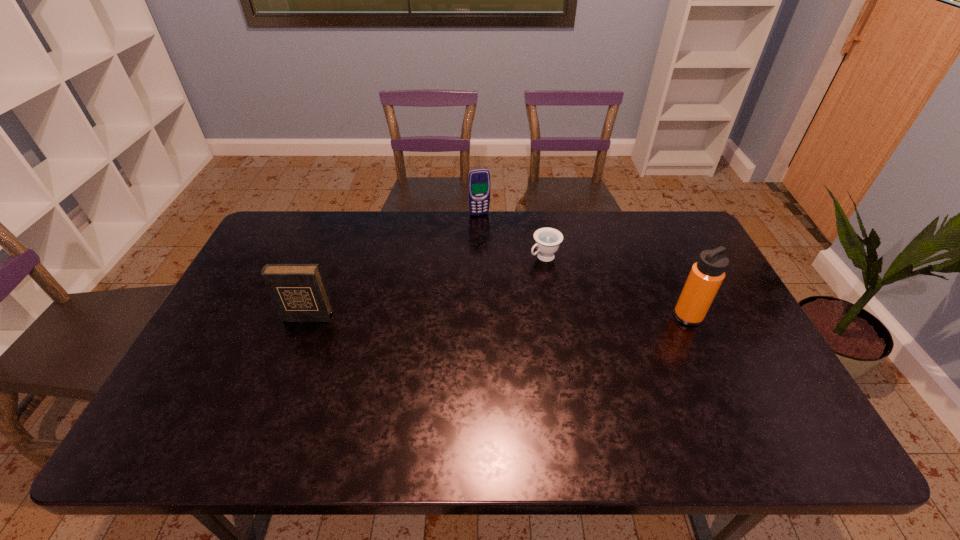
At what (x,y) coordinates should I click in order to perform the action: click on free spot on the desktop that is between the diary and the rightmost object and is positioned on the side of the teacup with the handle. Please return your answer as a coordinate pair (x, y). This screenshot has height=540, width=960. Looking at the image, I should click on (451, 316).

Identify the location of vacant space on the desktop that is between the leftmost object and the tallest object and is positioned on the front-facing side of the cellular telephone. (511, 316).